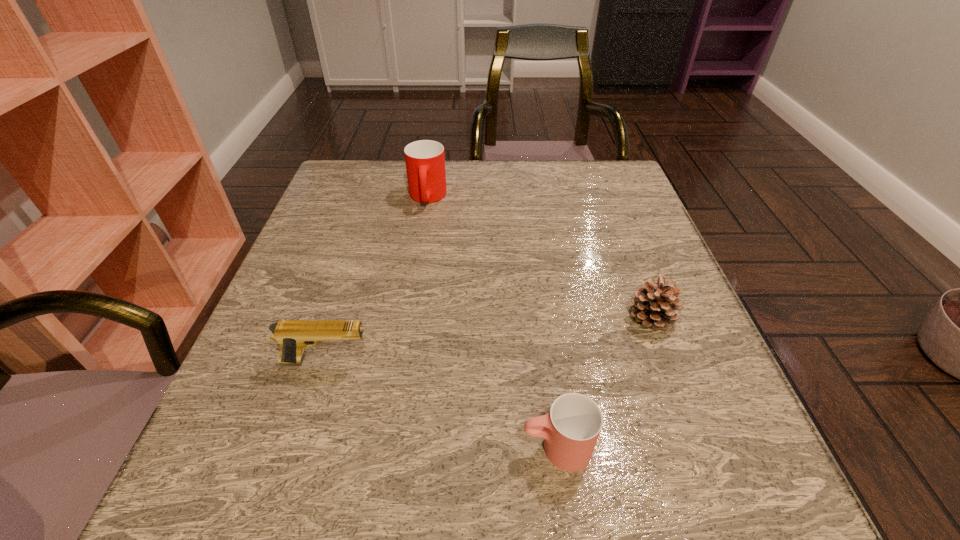
The image size is (960, 540). I want to click on free space located at the barrel of the third farthest object, so click(532, 361).

This screenshot has width=960, height=540. I want to click on vacant space located 0.240m on the side of the right cup with the handle, so click(x=353, y=448).

Locate an element on the screen. The height and width of the screenshot is (540, 960). blank space located 0.280m on the side of the right cup with the handle is located at coordinates (325, 448).

This screenshot has height=540, width=960. I want to click on free space located on the side of the right cup with the handle, so click(347, 448).

Locate an element on the screen. Image resolution: width=960 pixels, height=540 pixels. object located in the far edge section of the desktop is located at coordinates (425, 160).

I want to click on object that is positioned at the near edge, so click(x=571, y=428).

Identify the location of object that is positioned at the left edge. Image resolution: width=960 pixels, height=540 pixels. (293, 336).

The width and height of the screenshot is (960, 540). Find the location of `object that is at the right edge`. object that is at the right edge is located at coordinates (655, 305).

At what (x,y) coordinates should I click in order to perform the action: click on free region at the far edge of the desktop. Please return your answer as a coordinate pair (x, y). The width and height of the screenshot is (960, 540). Looking at the image, I should click on (460, 165).

The image size is (960, 540). I want to click on vacant space at the near edge, so click(319, 465).